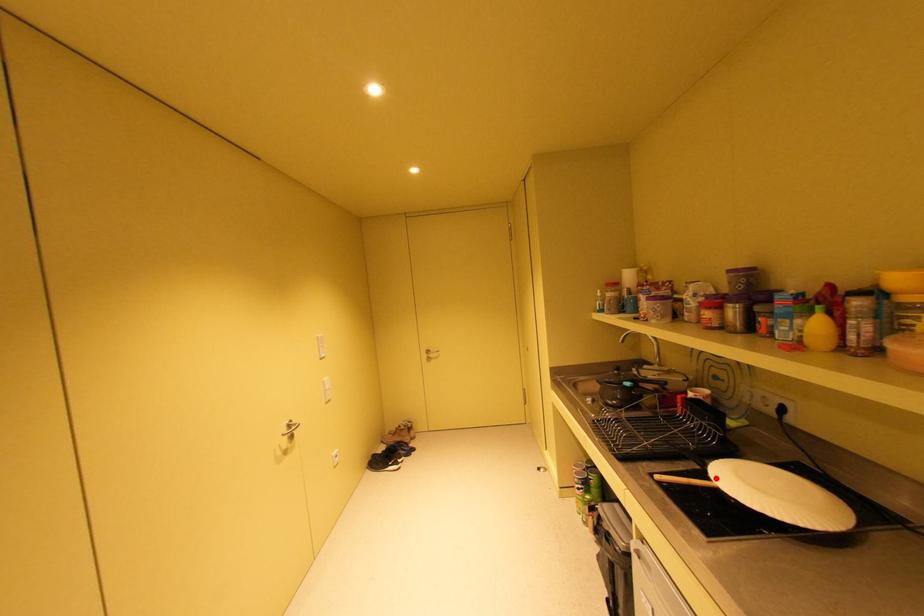
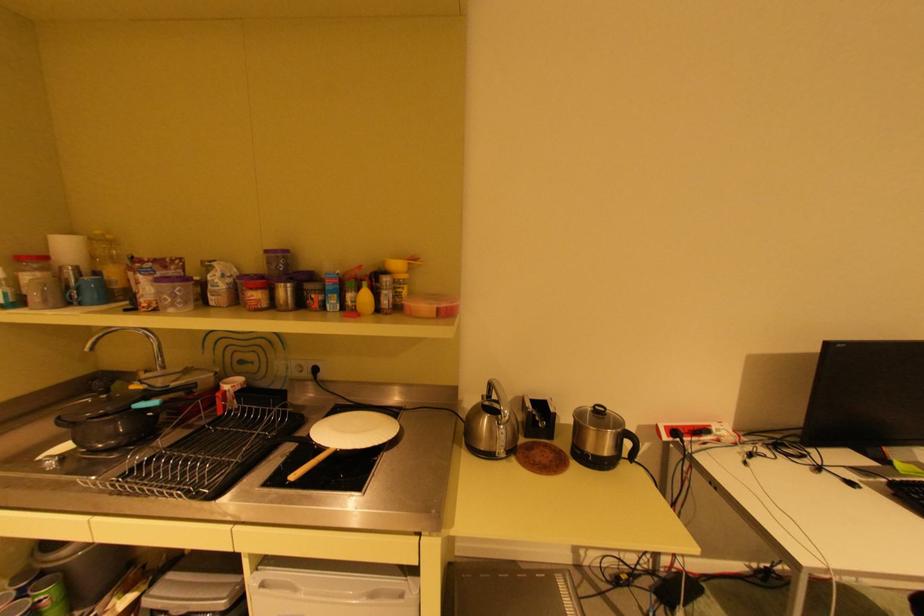
The point at the highlighted location is marked in the first image. Where is the corresponding point in the second image?

(330, 448)